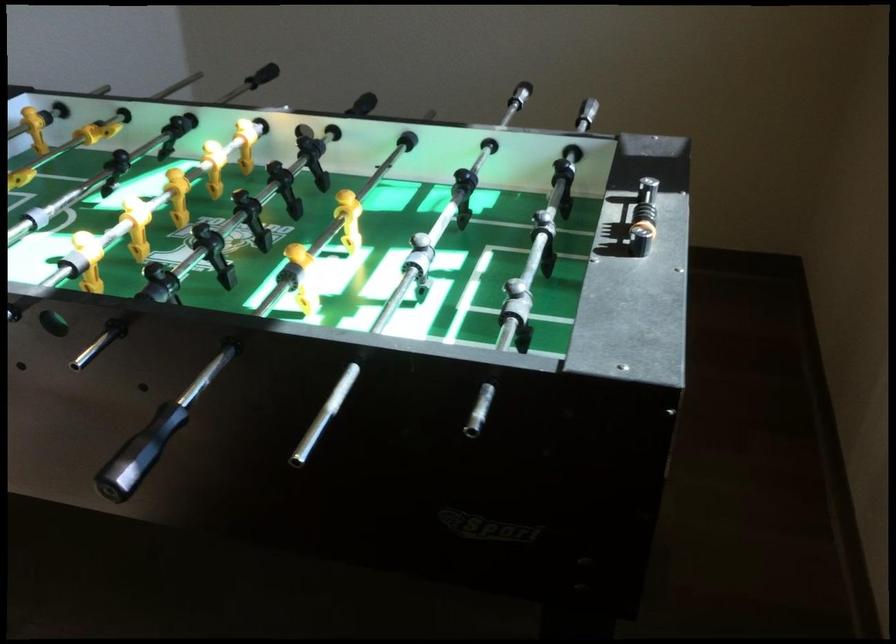
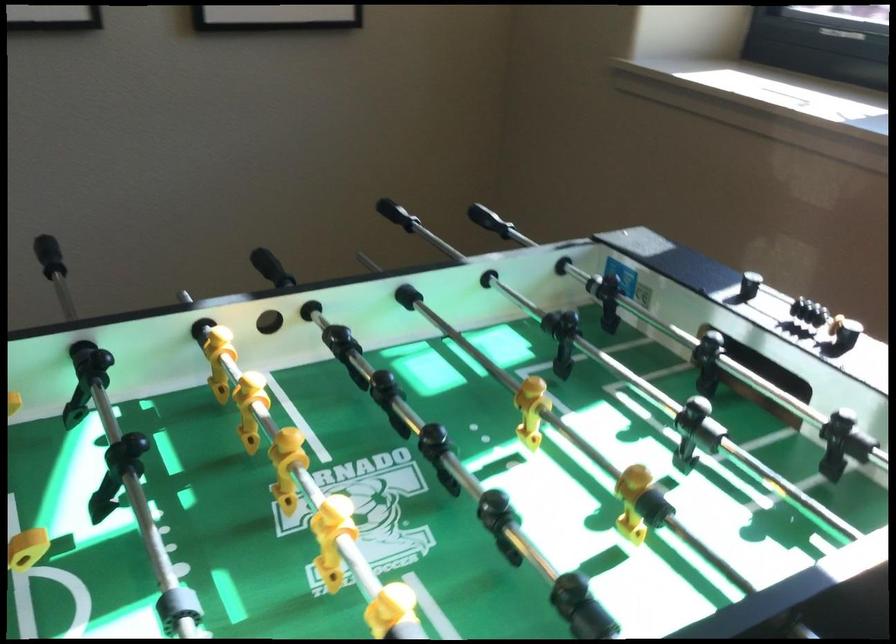
The point at (x=811, y=158) is marked in the first image. Where is the corresponding point in the second image?

(488, 220)